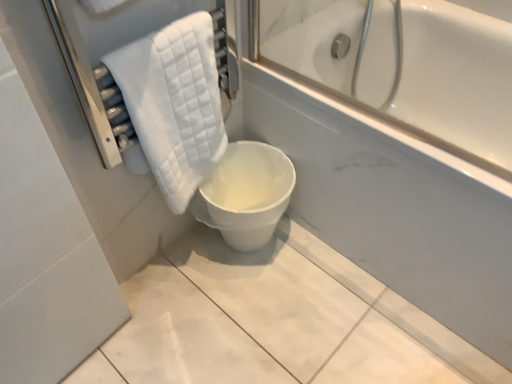
This screenshot has width=512, height=384. What do you see at coordinates (246, 194) in the screenshot?
I see `white glossy toilet at center` at bounding box center [246, 194].

The height and width of the screenshot is (384, 512). In order to click on white glossy toilet at center in this screenshot , I will do `click(246, 194)`.

Describe the element at coordinates (174, 103) in the screenshot. The image size is (512, 384). I see `white quilted towel at left` at that location.

This screenshot has height=384, width=512. Find the location of `white quilted towel at left`. white quilted towel at left is located at coordinates (174, 103).

Where is `white glossy toilet at center`? This screenshot has height=384, width=512. white glossy toilet at center is located at coordinates (246, 194).

Which is more to the right, white quilted towel at left or white glossy toilet at center?

Positioned to the right is white glossy toilet at center.

Between white quilted towel at left and white glossy toilet at center, which one is positioned behind?

white glossy toilet at center is behind.

Does point (177, 137) appear closer or farther from the camera than point (283, 180)?

Point (177, 137) appears to be closer to the viewer than point (283, 180).

From the image's perspective, would you say white quilted towel at left is shown under white glossy toilet at center?

Incorrect, from the image's perspective, white quilted towel at left is higher than white glossy toilet at center.

From a real-world perspective, is white quilted towel at left on top of white glossy toilet at center?

Yes, from a real-world perspective, white quilted towel at left is over white glossy toilet at center

Based on the photo, looking at their sizes, would you say white quilted towel at left is wider or thinner than white glossy toilet at center?

Clearly, white quilted towel at left has less width compared to white glossy toilet at center.

Considering the sizes of white quilted towel at left and white glossy toilet at center in the image, is white quilted towel at left taller or shorter than white glossy toilet at center?

Clearly, white quilted towel at left is taller compared to white glossy toilet at center.

Is white quilted towel at left bigger than white glossy toilet at center?

No, white quilted towel at left is not bigger than white glossy toilet at center.

Is white quilted towel at left inside or outside of white glossy toilet at center?

white quilted towel at left lies outside white glossy toilet at center.

Is white quilted towel at left next to white glossy toilet at center?

No, white quilted towel at left is not touching white glossy toilet at center.

Is white quilted towel at left turned away from white glossy toilet at center?

That's not correct — white quilted towel at left is not looking away from white glossy toilet at center.

How many degrees apart are the facing directions of white quilted towel at left and white glossy toilet at center?

There is a 2.26-degree angle between the facing directions of white quilted towel at left and white glossy toilet at center.

How distant is white quilted towel at left from white glossy toilet at center?

A distance of 9.71 inches exists between white quilted towel at left and white glossy toilet at center.

Find the location of a particular element. Image resolution: width=512 pixels, height=384 pixels. towel in front of the white glossy toilet at center is located at coordinates (174, 103).

Considering the relative positions of white glossy toilet at center and white quilted towel at left in the image provided, is white glossy toilet at center to the left of white quilted towel at left from the viewer's perspective?

In fact, white glossy toilet at center is to the right of white quilted towel at left.

Between white glossy toilet at center and white quilted towel at left, which one is positioned behind?

white glossy toilet at center is more distant.

Is point (217, 206) positioned in front of point (196, 134)?

No.

From the image's perspective, which object appears higher, white glossy toilet at center or white quilted towel at left?

From the image's view, white quilted towel at left is above.

From a real-world perspective, which object stands above the other?

white quilted towel at left.

Can you confirm if white glossy toilet at center is wider than white quilted towel at left?

Indeed, white glossy toilet at center has a greater width compared to white quilted towel at left.

Considering the sizes of white glossy toilet at center and white quilted towel at left in the image, is white glossy toilet at center taller or shorter than white quilted towel at left?

Clearly, white glossy toilet at center is shorter compared to white quilted towel at left.

Between white glossy toilet at center and white quilted towel at left, which one has smaller size?

white quilted towel at left.

Consider the image. Is white glossy toilet at center located outside white quilted towel at left?

Yes.

Is white glossy toilet at center in contact with white quilted towel at left?

white glossy toilet at center and white quilted towel at left are clearly separated.

Is white quilted towel at left at the back of white glossy toilet at center?

No, white glossy toilet at center's orientation is not away from white quilted towel at left.

Locate an element on the screen. toilet below the white quilted towel at left (from a real-world perspective) is located at coordinates (246, 194).

Find the location of a particular element. This screenshot has width=512, height=384. toilet that appears below the white quilted towel at left (from a real-world perspective) is located at coordinates (246, 194).

The height and width of the screenshot is (384, 512). I want to click on towel that is in front of the white glossy toilet at center, so click(174, 103).